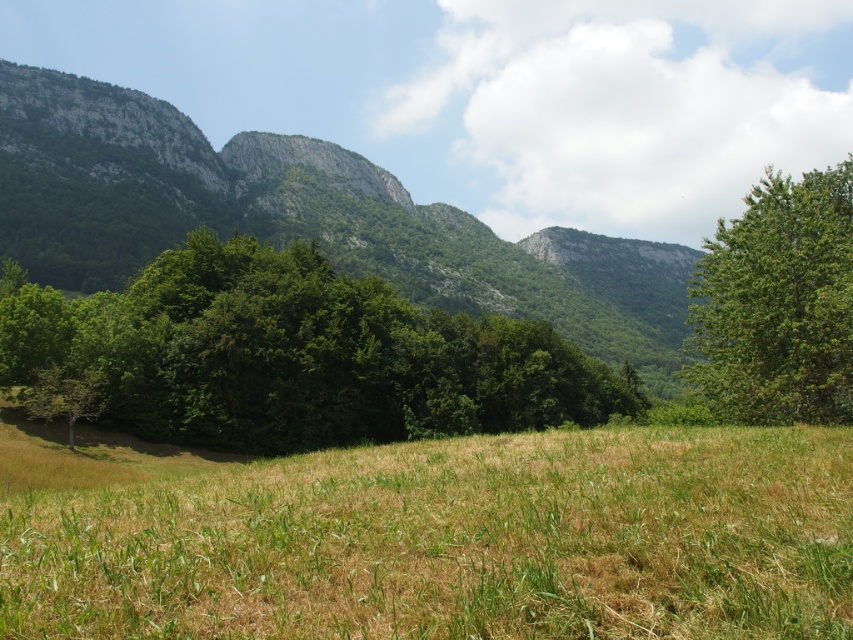
The width and height of the screenshot is (853, 640). Describe the element at coordinates (456, 541) in the screenshot. I see `brown dry grass at lower center` at that location.

Is brown dry grass at lower center to the right of green leafy tree at right from the viewer's perspective?

In fact, brown dry grass at lower center is to the left of green leafy tree at right.

Locate an element on the screen. brown dry grass at lower center is located at coordinates (456, 541).

I want to click on brown dry grass at lower center, so click(x=456, y=541).

Which is behind, point (845, 568) or point (38, 387)?

Point (38, 387)

Describe the element at coordinates (456, 541) in the screenshot. I see `brown dry grass at lower center` at that location.

Where is `brown dry grass at lower center`? This screenshot has height=640, width=853. brown dry grass at lower center is located at coordinates (456, 541).

How much distance is there between brown dry grass at lower center and green rock mountain at center?

They are 166.37 meters apart.

Which is above, brown dry grass at lower center or green rock mountain at center?

green rock mountain at center

Find the location of `brown dry grass at lower center`. brown dry grass at lower center is located at coordinates (456, 541).